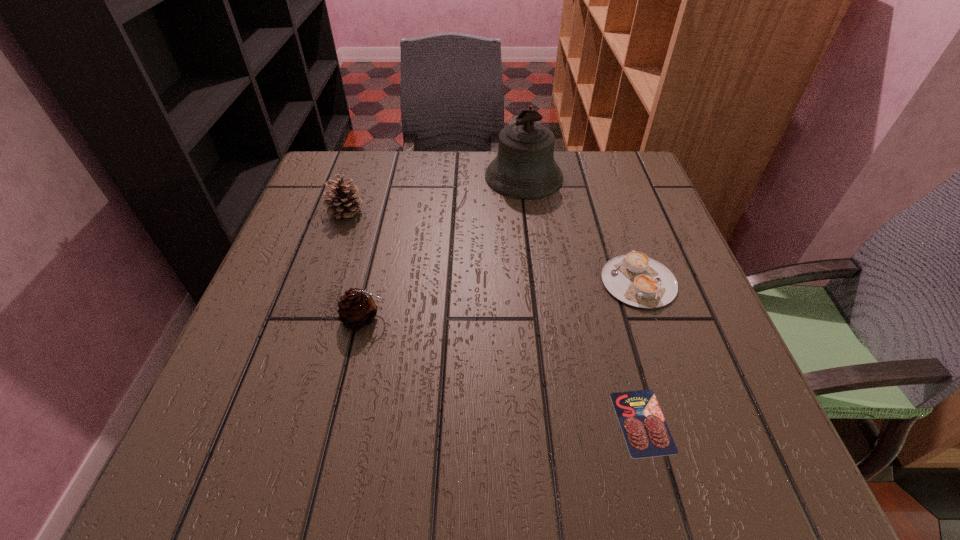
I want to click on vacant space situated 0.220m on the front of the left pinecone, so click(316, 296).

This screenshot has height=540, width=960. Find the location of `free region located with a leaf charm attached to the shorter pinecone`. free region located with a leaf charm attached to the shorter pinecone is located at coordinates (498, 319).

Locate an element on the screen. The height and width of the screenshot is (540, 960). vacant position located on the back of the fourth tallest object is located at coordinates (607, 189).

Locate an element on the screen. free space located on the back of the salami is located at coordinates pyautogui.click(x=612, y=312).

The width and height of the screenshot is (960, 540). I want to click on bell at the far edge, so [524, 168].

This screenshot has width=960, height=540. In order to click on pinecone that is at the far edge in this screenshot , I will do `click(341, 203)`.

The image size is (960, 540). I want to click on object that is positioned at the near edge, so click(x=646, y=433).

Identify the location of object at the left edge. The height and width of the screenshot is (540, 960). (341, 203).

The height and width of the screenshot is (540, 960). What are the coordinates of `cappuccino present at the right edge` in the screenshot? It's located at (635, 279).

This screenshot has width=960, height=540. I want to click on salami that is at the right edge, so click(x=646, y=433).